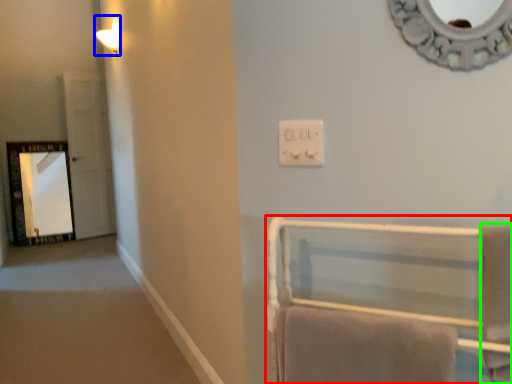
Question: Based on their relative distances, which object is farther from furniture (highlighted by a red box)? Choose from light fixture (highlighted by a blue box) and bath towel (highlighted by a green box).

Choices:
 (A) light fixture
 (B) bath towel

Answer: (A)